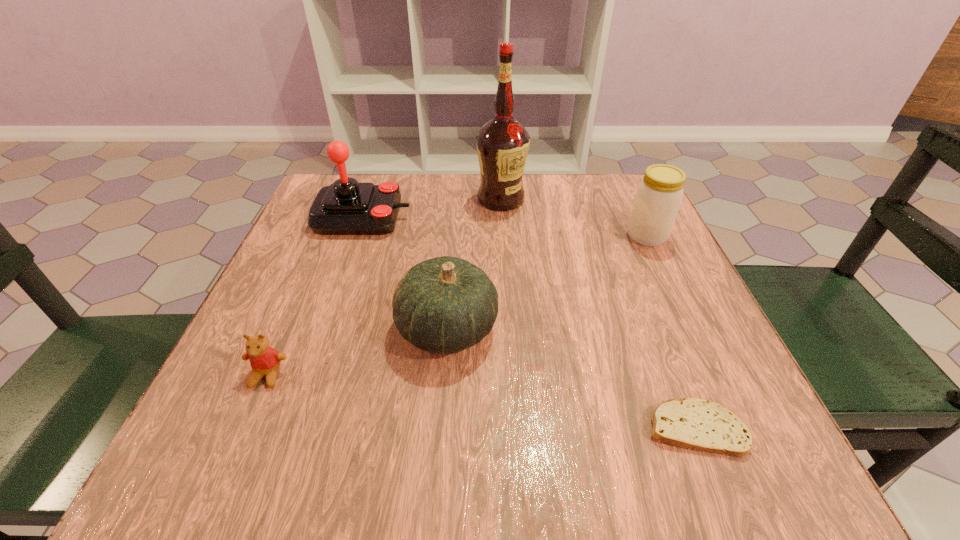
At what (x,y) coordinates should I click in order to perform the action: click on alcohol. Please return your answer as a coordinate pair (x, y). This screenshot has width=960, height=540. Looking at the image, I should click on (502, 143).

Where is `joystick`? The width and height of the screenshot is (960, 540). joystick is located at coordinates (346, 207).

This screenshot has height=540, width=960. I want to click on jar, so click(658, 197).

Where is `gourd`? The height and width of the screenshot is (540, 960). gourd is located at coordinates (445, 304).

Where is `the fifth tallest object`? the fifth tallest object is located at coordinates (265, 361).

At what (x,y) coordinates should I click in order to perform the action: click on the shortest object. Please return your answer as a coordinate pair (x, y). Looking at the image, I should click on (693, 423).

This screenshot has width=960, height=540. Identify the location of the nearest object. (693, 423).

The width and height of the screenshot is (960, 540). Identify the location of vacant area situated on the label of the tallest object. (507, 286).

You are a GUI agent. You are given a task and a screenshot of the screen. Output one action in this format:
    pyautogui.click(x=<x>, y=<y>)
    Task: Click on the free space located on the base of the joystick
    The height and width of the screenshot is (540, 960).
    Given the screenshot: What is the action you would take?
    pyautogui.click(x=503, y=218)

Where is `free location located 0.190m on the back of the jar`? free location located 0.190m on the back of the jar is located at coordinates (622, 183).